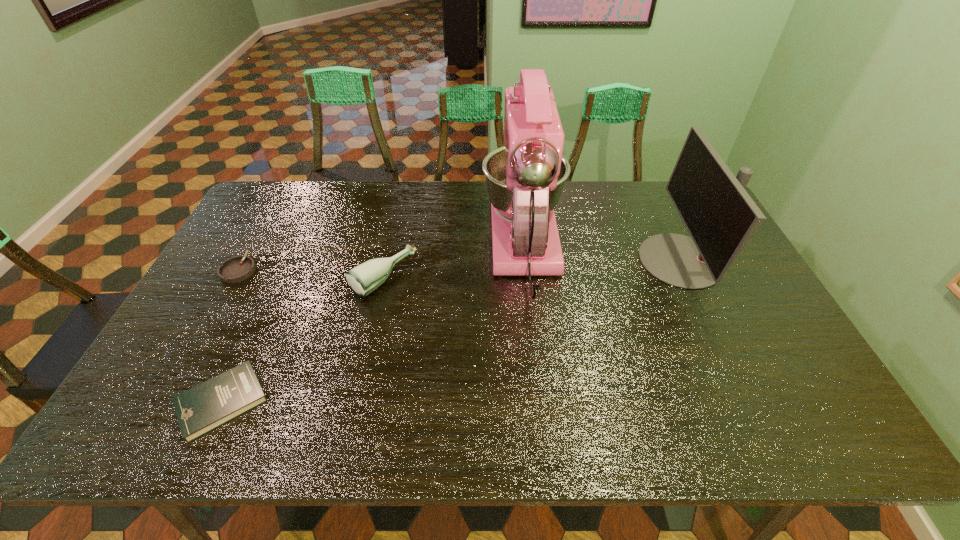
Where is `the fourth object from left to right`? the fourth object from left to right is located at coordinates (525, 178).

Identify the location of mixer. (525, 178).

Find the location of `computer monitor`. computer monitor is located at coordinates (720, 216).

The width and height of the screenshot is (960, 540). Find the location of `the second tallest object`. the second tallest object is located at coordinates (720, 216).

Image resolution: width=960 pixels, height=540 pixels. In order to click on the third tallest object in this screenshot , I will do click(x=363, y=279).

Where is `bottle`? Image resolution: width=960 pixels, height=540 pixels. bottle is located at coordinates (363, 279).

Where is `ashtray`? This screenshot has width=960, height=540. ashtray is located at coordinates (238, 268).

Where is `the shortest object`? Image resolution: width=960 pixels, height=540 pixels. the shortest object is located at coordinates (199, 410).

Where is `the nearest object`? the nearest object is located at coordinates (199, 410).

I want to click on vacant space located 0.060m on the face of the mixer, so click(518, 186).